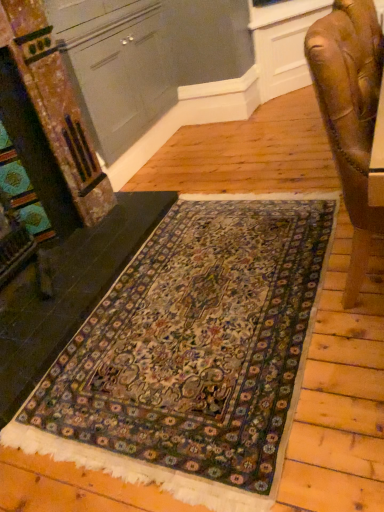
I want to click on empty space that is ontop of carpeted rug at center (from a real-world perspective), so click(188, 306).